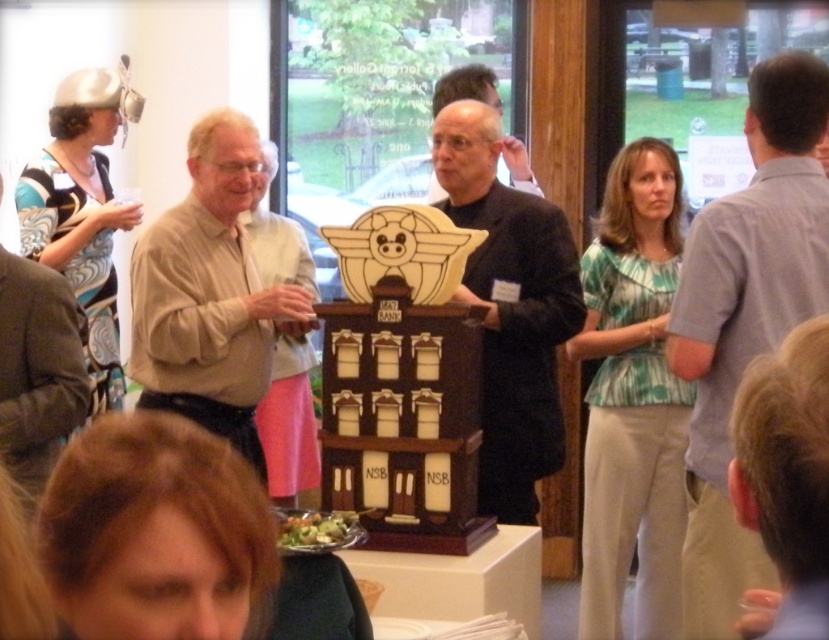
Question: Does matte beige shirt at left have a greater width compared to matte black man at center?

Choices:
 (A) yes
 (B) no

Answer: (A)

Question: Which point appears closest to the camera in this image?

Choices:
 (A) (483, 291)
 (B) (153, 358)

Answer: (B)

Question: Considering the real-world distances, which object is closest to the dark brown suit at center?

Choices:
 (A) matte black man at center
 (B) gray cotton shirt at upper right
 (C) brown leather jacket at upper left

Answer: (B)

Question: Which of these objects is positioned farthest from the dark brown suit at center?

Choices:
 (A) matte black man at center
 (B) gray cotton shirt at upper right
 (C) matte beige shirt at left

Answer: (A)

Question: Can you confirm if gray cotton shirt at upper right is thinner than matte black man at center?

Choices:
 (A) yes
 (B) no

Answer: (B)

Question: Where is gray cotton shirt at upper right located in relation to brown leather jacket at upper left in the image?

Choices:
 (A) left
 (B) right

Answer: (B)